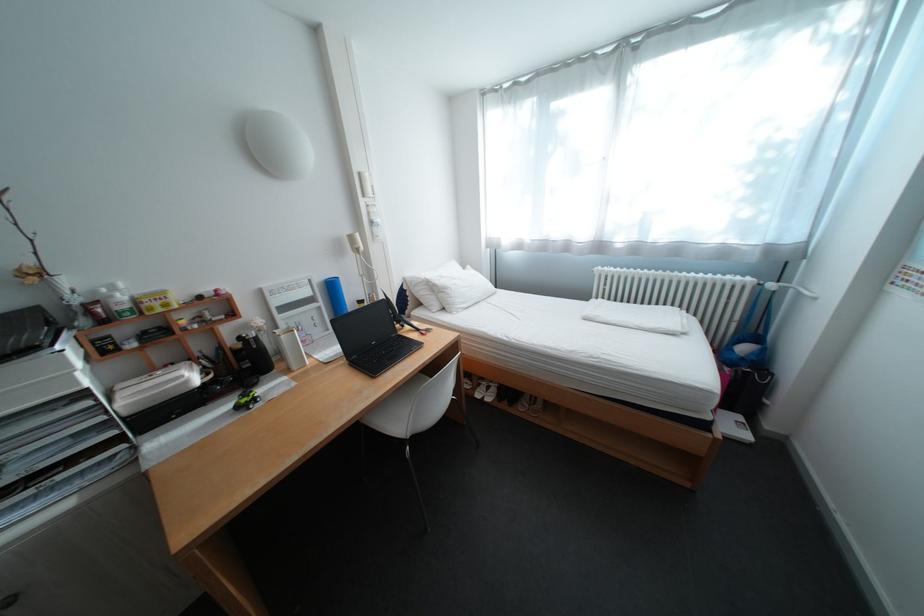
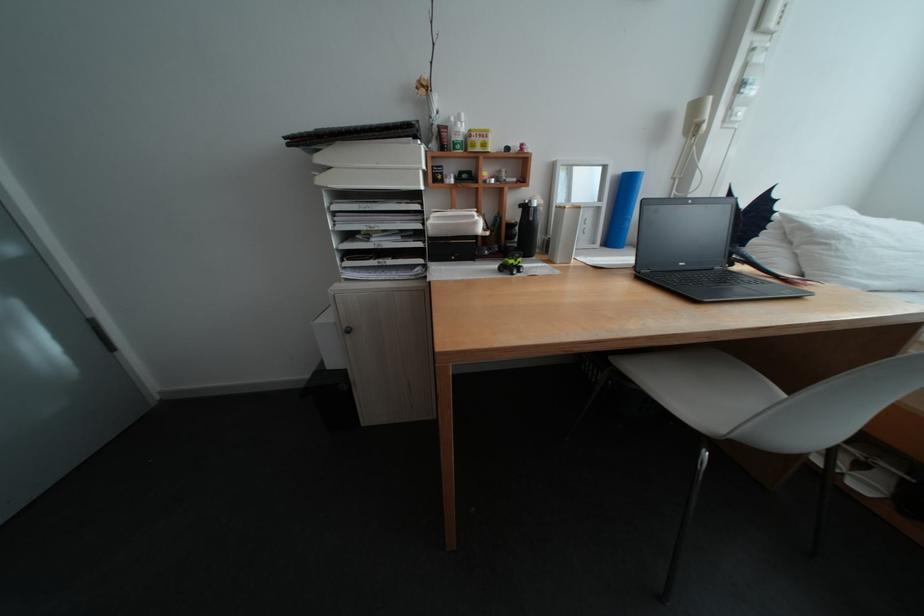
Where in the second image is the point corresponding to [157,302] from the first image?

(485, 135)